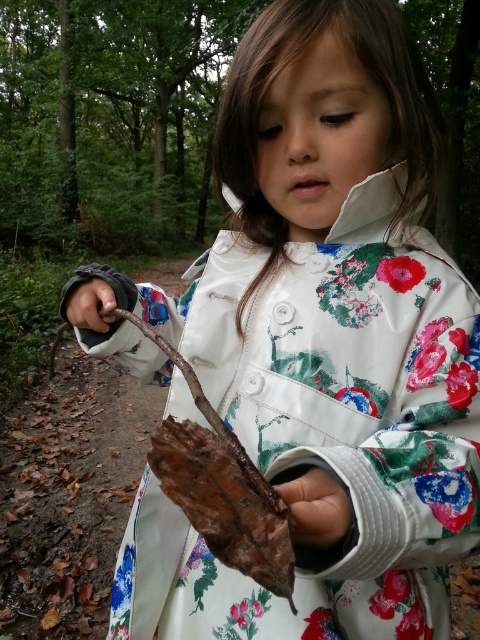
Does point (333, 477) come in front of point (82, 294)?

Yes, it is.

Who is lower down, brown rough leaf at lower center or dark brown leather hand at lower left?

Positioned lower is brown rough leaf at lower center.

Which is in front, point (313, 509) or point (113, 298)?

Positioned in front is point (313, 509).

Find the location of a particular element. The image size is (480, 640). brown rough leaf at lower center is located at coordinates pyautogui.click(x=314, y=506).